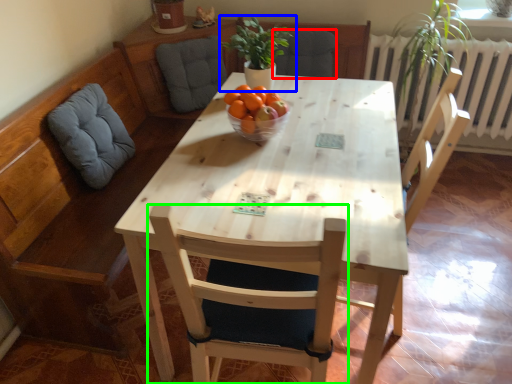
Question: Which object is positioned farthest from armchair (highlighted by a red box)? Select from houseplant (highlighted by a blue box) and chair (highlighted by a green box).

Choices:
 (A) houseplant
 (B) chair

Answer: (B)